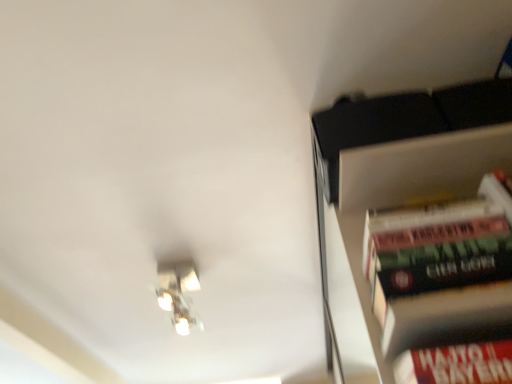
Where is `metallic silver light fixture at upper left`? metallic silver light fixture at upper left is located at coordinates (178, 292).

Measure the distance between point (175, 305) and camera.

A distance of 5.75 feet exists between point (175, 305) and camera.

Describe the element at coordinates (178, 292) in the screenshot. This screenshot has width=512, height=384. I see `metallic silver light fixture at upper left` at that location.

Locate an element on the screen. hardcover book at right is located at coordinates (445, 286).

What do you see at coordinates (445, 286) in the screenshot? Image resolution: width=512 pixels, height=384 pixels. I see `hardcover book at right` at bounding box center [445, 286].

Where is `metallic silver light fixture at upper left`? This screenshot has height=384, width=512. metallic silver light fixture at upper left is located at coordinates (178, 292).

Considering the positions of objects hardcover book at right and metallic silver light fixture at upper left in the image provided, who is more to the right, hardcover book at right or metallic silver light fixture at upper left?

From the viewer's perspective, hardcover book at right appears more on the right side.

Is hardcover book at right further to camera compared to metallic silver light fixture at upper left?

No, hardcover book at right is in front of metallic silver light fixture at upper left.

Is point (462, 316) farther from viewer compared to point (161, 307)?

That is False.

From the image's perspective, is hardcover book at right over metallic silver light fixture at upper left?

Yes, from the image's perspective, hardcover book at right is over metallic silver light fixture at upper left.

From a real-world perspective, is hardcover book at right above or below metallic silver light fixture at upper left?

From a real-world perspective, hardcover book at right is physically below metallic silver light fixture at upper left.

Is hardcover book at right wider than metallic silver light fixture at upper left?

Incorrect, the width of hardcover book at right does not surpass that of metallic silver light fixture at upper left.

Who is shorter, hardcover book at right or metallic silver light fixture at upper left?

Standing shorter between the two is metallic silver light fixture at upper left.

Does hardcover book at right have a smaller size compared to metallic silver light fixture at upper left?

Yes.

Is metallic silver light fixture at upper left completely or partially inside hardcover book at right?

That's incorrect, metallic silver light fixture at upper left is not inside hardcover book at right.

Is hardcover book at right placed right next to metallic silver light fixture at upper left?

No, hardcover book at right is not making contact with metallic silver light fixture at upper left.

Is hardcover book at right looking in the opposite direction of metallic silver light fixture at upper left?

hardcover book at right is not turned away from metallic silver light fixture at upper left.

How different are the orientations of hardcover book at right and metallic silver light fixture at upper left in degrees?

The facing directions of hardcover book at right and metallic silver light fixture at upper left are 2.05 degrees apart.

Identify the location of book to the right of metallic silver light fixture at upper left. (445, 286).

Between metallic silver light fixture at upper left and hardcover book at right, which one appears on the right side from the viewer's perspective?

hardcover book at right.

Which object is closer to the camera taking this photo, metallic silver light fixture at upper left or hardcover book at right?

hardcover book at right is more forward.

Is point (177, 268) more distant than point (409, 345)?

Yes, point (177, 268) is behind point (409, 345).

Looking at this image, from the image's perspective, which is above, metallic silver light fixture at upper left or hardcover book at right?

hardcover book at right appears higher in the image.

From a real-world perspective, is metallic silver light fixture at upper left positioned above or below hardcover book at right?

From a real-world perspective, metallic silver light fixture at upper left is physically above hardcover book at right.

Between metallic silver light fixture at upper left and hardcover book at right, which one has smaller width?

With smaller width is hardcover book at right.

Which of these two, metallic silver light fixture at upper left or hardcover book at right, stands shorter?

Standing shorter between the two is metallic silver light fixture at upper left.

Who is bigger, metallic silver light fixture at upper left or hardcover book at right?

With larger size is metallic silver light fixture at upper left.

Would you say metallic silver light fixture at upper left is outside hardcover book at right?

metallic silver light fixture at upper left is positioned outside hardcover book at right.

Is metallic silver light fixture at upper left far away from hardcover book at right?

That's right, there is a large distance between metallic silver light fixture at upper left and hardcover book at right.

Is metallic silver light fixture at upper left looking in the opposite direction of hardcover book at right?

No, metallic silver light fixture at upper left is not facing away from hardcover book at right.

You are a GUI agent. You are given a task and a screenshot of the screen. Output one action in this format:
    pyautogui.click(x=<x>, y=<y>)
    Task: Click on the light fixture below the hardcover book at right (from the image's perspective)
    The width and height of the screenshot is (512, 384).
    Given the screenshot: What is the action you would take?
    pyautogui.click(x=178, y=292)

Locate an element on the screen. The height and width of the screenshot is (384, 512). light fixture below the hardcover book at right (from the image's perspective) is located at coordinates (178, 292).

The image size is (512, 384). I want to click on book on the right of metallic silver light fixture at upper left, so click(445, 286).